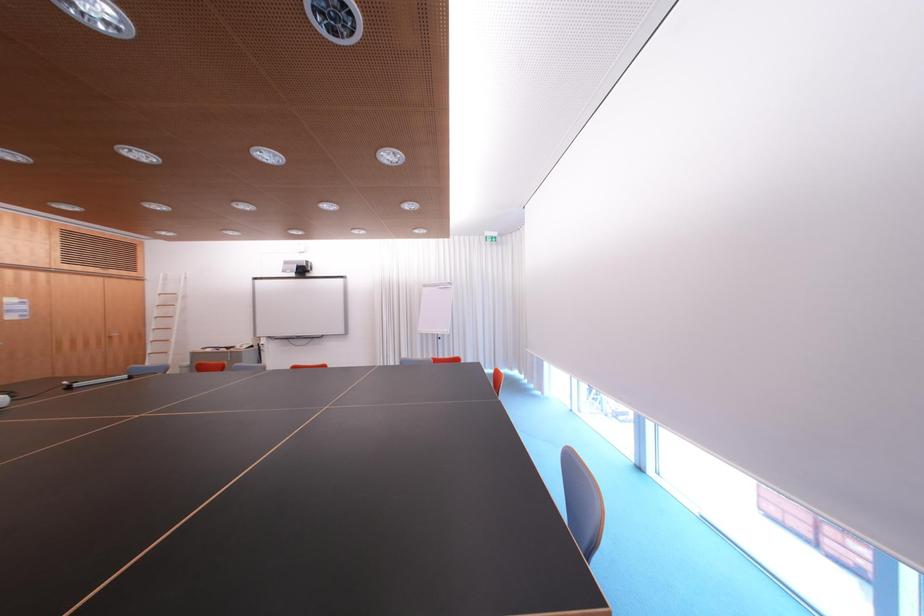
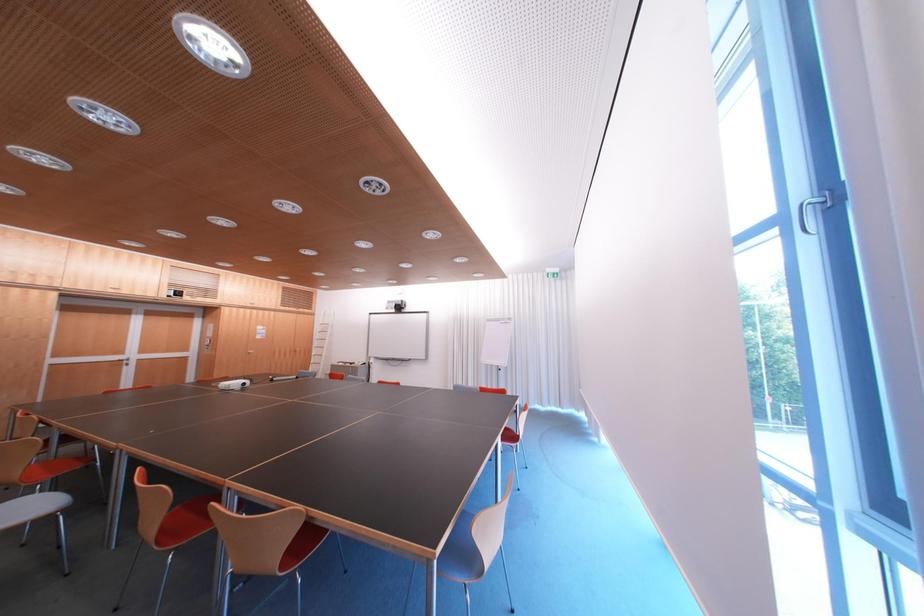
What movement of the cameraman would produce the second image?

The cameraman moved toward right, backward.